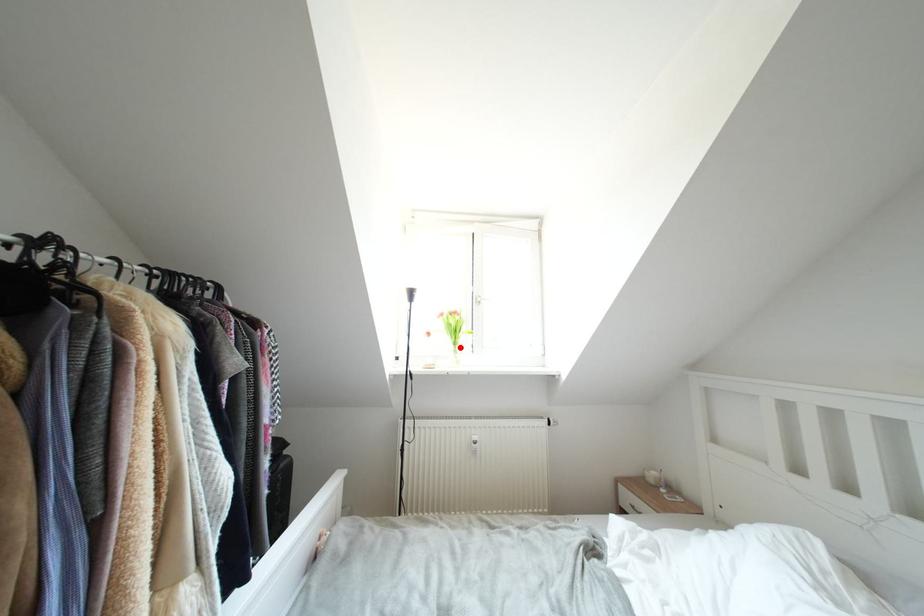
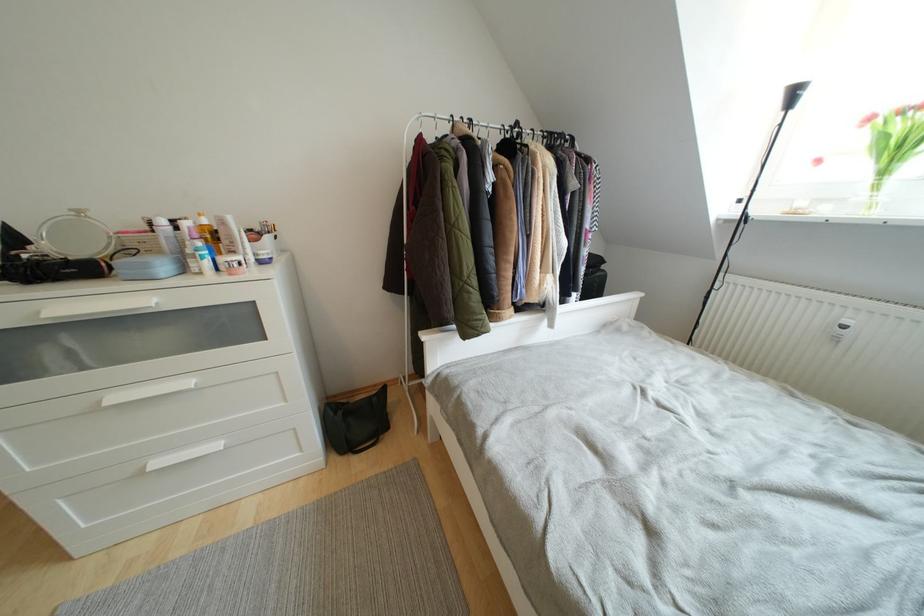
Question: I am providing you with two images of the same scene from different viewpoints. Given a red point in image1, look at the same physical point in image2. Is it:

Choices:
 (A) Closer to the viewpoint
 (B) Farther from the viewpoint

Answer: (B)